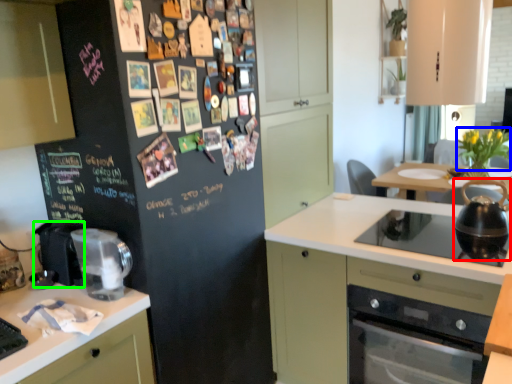
Question: Considering the real-world distances, which object is farthest from kitchen appliance (highlighted by a red box)? flower (highlighted by a blue box) or appliance (highlighted by a green box)?

Choices:
 (A) flower
 (B) appliance

Answer: (B)